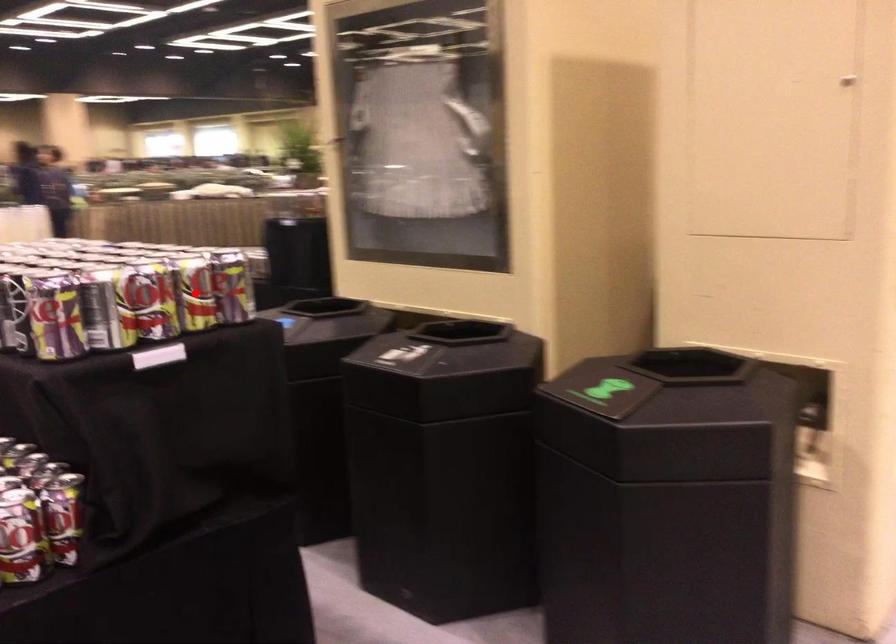
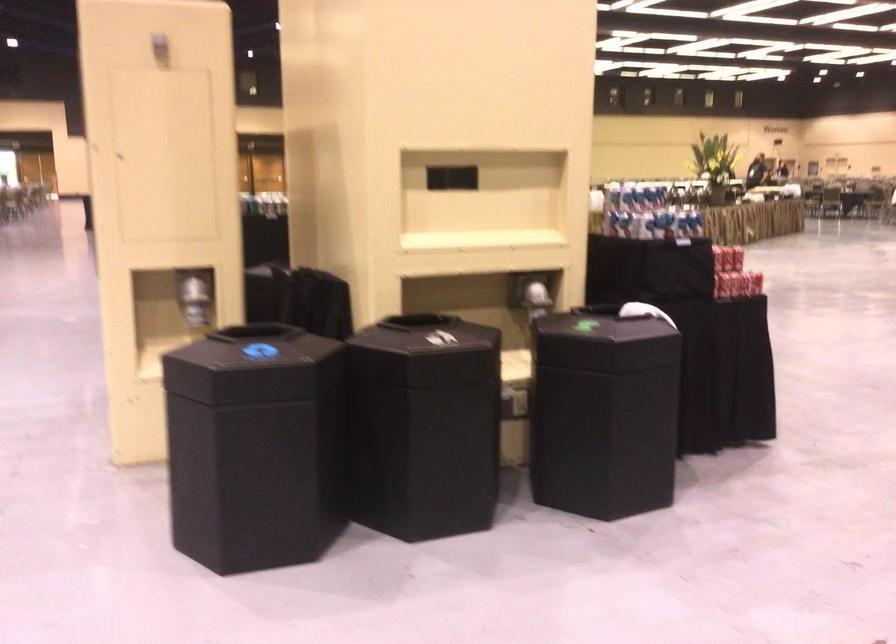
Question: I am providing you with two images of the same scene from different viewpoints. A red point is marked on the first image. At the location where the point appears in image 1, is it still visible in image 2?

Choices:
 (A) Yes
 (B) No

Answer: (B)